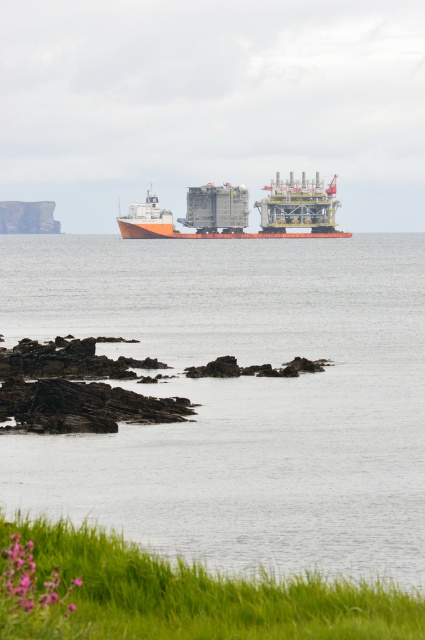
Which of these two, clear water at center or orange matte cargo ship at center, stands shorter?

With less height is orange matte cargo ship at center.

Is clear water at center to the left of orange matte cargo ship at center from the viewer's perspective?

No, clear water at center is not to the left of orange matte cargo ship at center.

Where is `clear water at center`? Image resolution: width=425 pixels, height=640 pixels. clear water at center is located at coordinates (238, 397).

You are a GUI agent. You are given a task and a screenshot of the screen. Output one action in this format:
    pyautogui.click(x=<x>, y=<y>)
    Task: Click on the clear water at center
    The height and width of the screenshot is (640, 425).
    Given the screenshot: What is the action you would take?
    pyautogui.click(x=238, y=397)